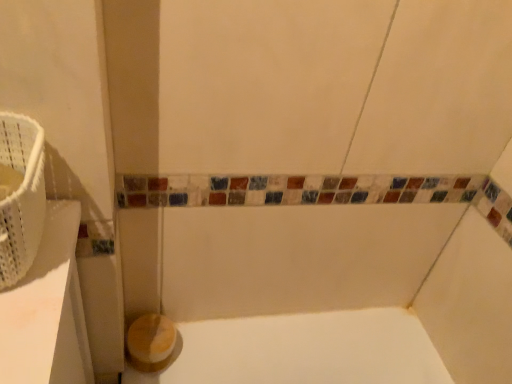
Find the location of a particular element. The image size is (512, 384). wooden toilet paper at lower left is located at coordinates pos(150,342).

The width and height of the screenshot is (512, 384). What do you see at coordinates (150, 342) in the screenshot?
I see `wooden toilet paper at lower left` at bounding box center [150, 342].

This screenshot has height=384, width=512. I want to click on white woven basket at left, so click(20, 195).

This screenshot has height=384, width=512. What do you see at coordinates (20, 195) in the screenshot? I see `white woven basket at left` at bounding box center [20, 195].

Looking at this image, what is the approximate width of white woven basket at left?

white woven basket at left is 6.50 inches wide.

What are the coordinates of `wooden toilet paper at lower left` in the screenshot? It's located at (150, 342).

Between white woven basket at left and wooden toilet paper at lower left, which one appears on the right side from the viewer's perspective?

Positioned to the right is wooden toilet paper at lower left.

Considering the positions of objects white woven basket at left and wooden toilet paper at lower left in the image provided, who is behind, white woven basket at left or wooden toilet paper at lower left?

wooden toilet paper at lower left is further away from the camera.

Is point (19, 244) positioned before point (154, 314)?

Yes, point (19, 244) is closer to viewer.

From the image's perspective, which is below, white woven basket at left or wooden toilet paper at lower left?

wooden toilet paper at lower left is shown below in the image.

From a real-world perspective, is white woven basket at left on top of wooden toilet paper at lower left?

Yes.

Based on the photo, considering the sizes of white woven basket at left and wooden toilet paper at lower left in the image, is white woven basket at left wider or thinner than wooden toilet paper at lower left?

In the image, white woven basket at left appears to be wider than wooden toilet paper at lower left.

Does white woven basket at left have a lesser height compared to wooden toilet paper at lower left?

No, white woven basket at left is not shorter than wooden toilet paper at lower left.

Does white woven basket at left have a larger size compared to wooden toilet paper at lower left?

Yes, white woven basket at left is bigger than wooden toilet paper at lower left.

Would you say wooden toilet paper at lower left is part of white woven basket at left's contents?

No.

Are white woven basket at left and wooden toilet paper at lower left located far from each other?

white woven basket at left is actually quite close to wooden toilet paper at lower left.

Is white woven basket at left aimed at wooden toilet paper at lower left?

No, white woven basket at left is not turned towards wooden toilet paper at lower left.

How different are the orientations of white woven basket at left and wooden toilet paper at lower left in degrees?

0.382 degrees separate the facing orientations of white woven basket at left and wooden toilet paper at lower left.

Locate an element on the screen. This screenshot has width=512, height=384. toilet paper that appears below the white woven basket at left (from a real-world perspective) is located at coordinates (150, 342).

In the scene shown: In the image, is wooden toilet paper at lower left on the left side or the right side of white woven basket at left?

wooden toilet paper at lower left is positioned on white woven basket at left's right side.

Which object is closer to the camera taking this photo, wooden toilet paper at lower left or white woven basket at left?

white woven basket at left is more forward.

Considering the positions of point (141, 332) and point (21, 237), is point (141, 332) closer or farther from the camera than point (21, 237)?

Clearly, point (141, 332) is more distant from the camera than point (21, 237).

From the image's perspective, is wooden toilet paper at lower left below white woven basket at left?

Yes.

From a real-world perspective, between wooden toilet paper at lower left and white woven basket at left, who is vertically higher?

white woven basket at left.

Is wooden toilet paper at lower left wider than white woven basket at left?

No.

Who is shorter, wooden toilet paper at lower left or white woven basket at left?

wooden toilet paper at lower left.

Between wooden toilet paper at lower left and white woven basket at left, which one has smaller size?

Smaller between the two is wooden toilet paper at lower left.

Is wooden toilet paper at lower left located outside white woven basket at left?

Yes, wooden toilet paper at lower left is not within white woven basket at left.

In the scene shown: Is wooden toilet paper at lower left touching white woven basket at left?

No, wooden toilet paper at lower left is not with white woven basket at left.

Is wooden toilet paper at lower left oriented away from white woven basket at left?

No.

Image resolution: width=512 pixels, height=384 pixels. I want to click on basket in front of the wooden toilet paper at lower left, so click(20, 195).

In the image, there is a white woven basket at left. Where is `toilet paper below it (from a real-world perspective)`? The height and width of the screenshot is (384, 512). toilet paper below it (from a real-world perspective) is located at coordinates (150, 342).

Image resolution: width=512 pixels, height=384 pixels. In the image, there is a wooden toilet paper at lower left. In order to click on basket above it (from the image's perspective) in this screenshot , I will do `click(20, 195)`.